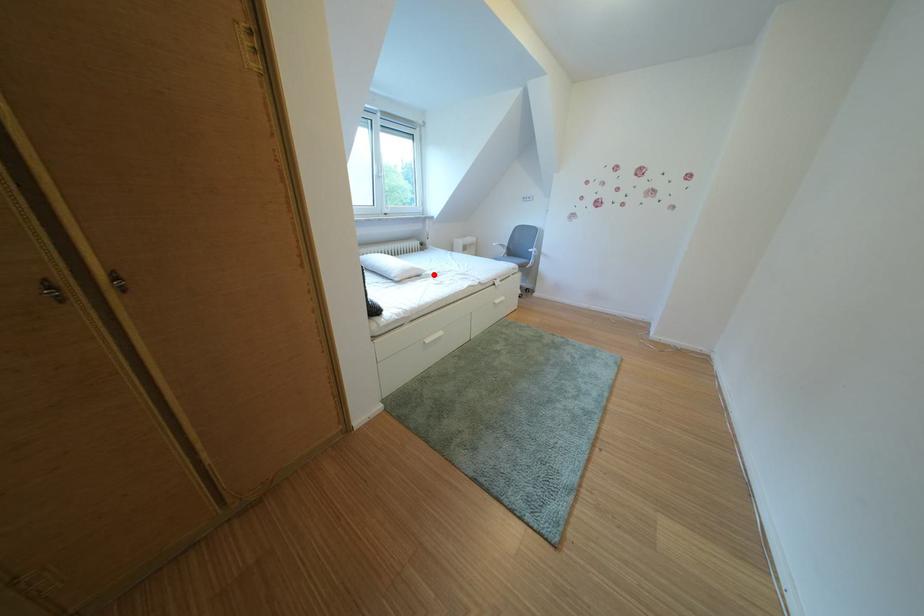
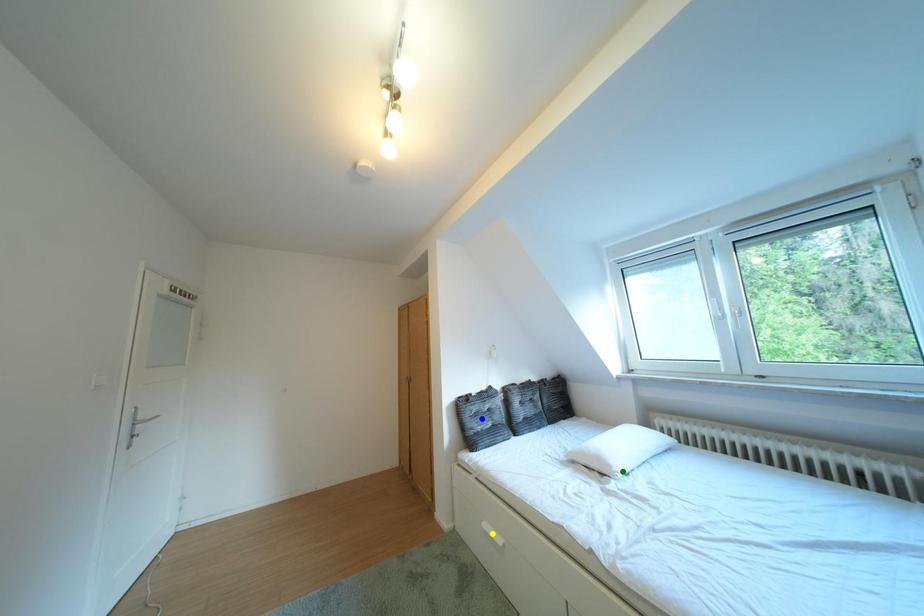
Question: I am providing you with two images of the same scene from different viewpoints. A red point is marked on the first image. You are given multiple points on the second image. Which point in image 2 represents the same 3d spot as the red point in image 1?

Choices:
 (A) blue point
 (B) yellow point
 (C) green point

Answer: (C)